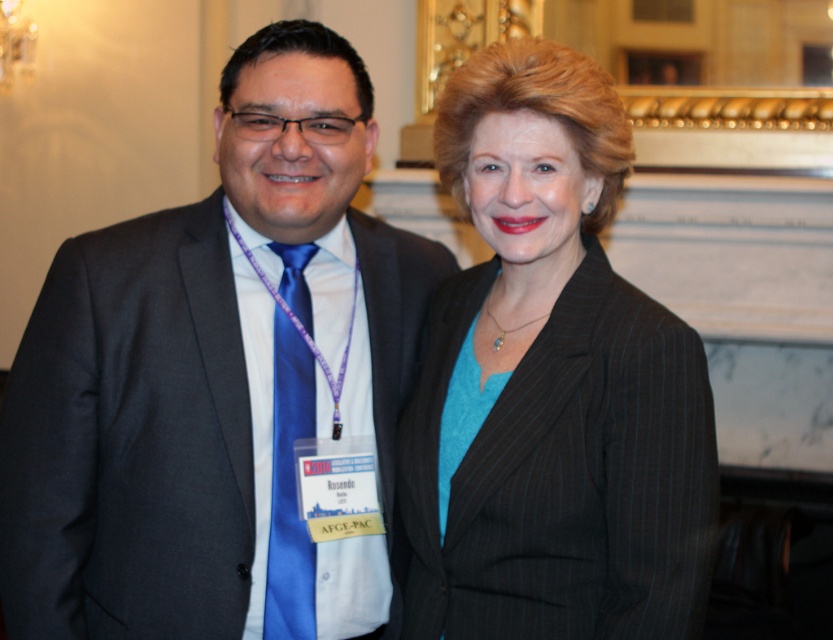
You are a photographer at a formal event. You need to adjust the lighting so that both the matte black blazer at center and the blue silk tie at left are equally visible. Which object should you focus on first to ensure proper exposure?

The matte black blazer at center should be focused on first because black absorbs more light and may require additional illumination to appear properly exposed, while the blue silk tie at left is lighter in color and might already be sufficiently lit.

In the scene shown: You are a photographer adjusting your camera settings to capture the best possible image. You notice the matte black suit at center and the blue silk tie at left. Which object is positioned higher in the frame?

The matte black suit at center is located above the blue silk tie at left, so it is positioned higher in the frame.